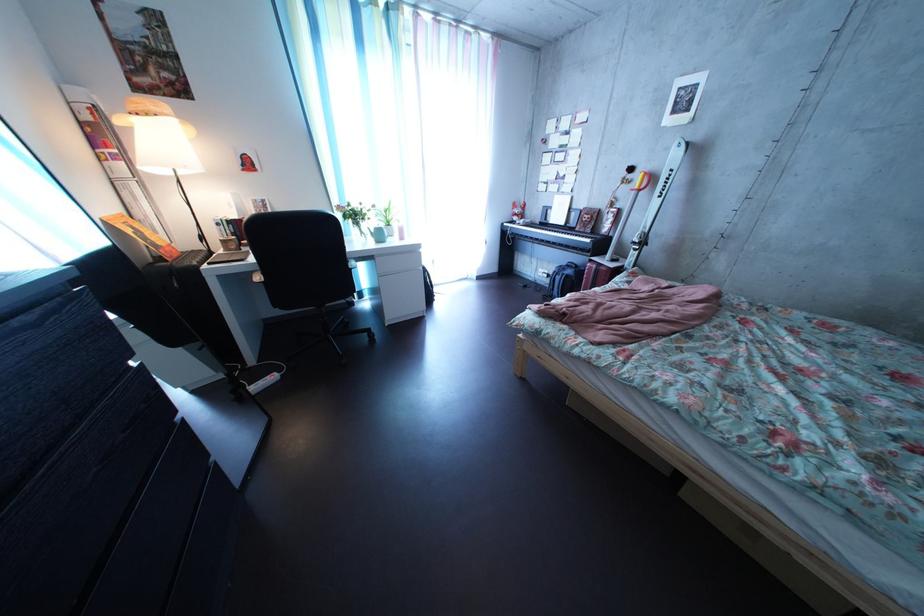
Which object does [142,235] point to?

This point indicates the orange book.